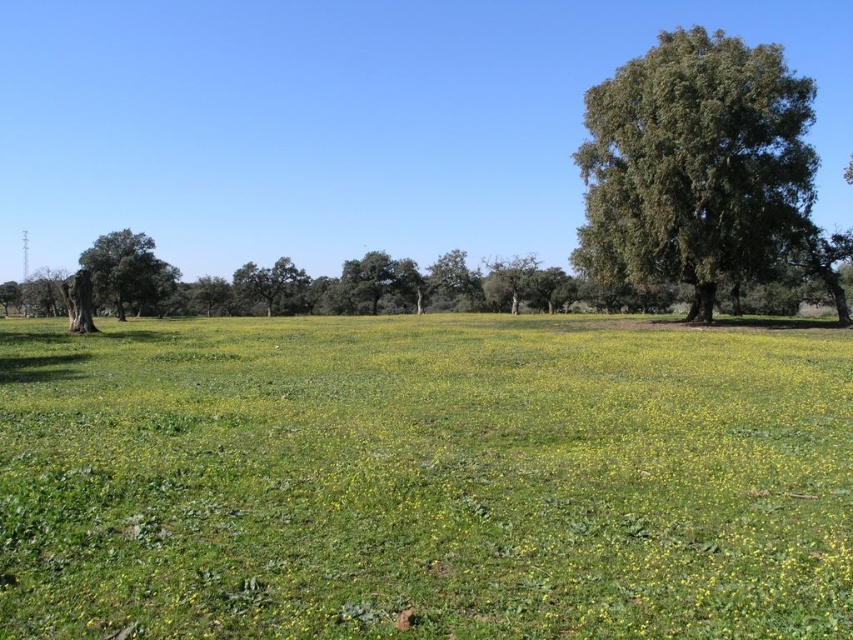
You are standing at the center of the field and want to walk towards the smooth green tree at left. Which direction should you face to head directly towards it?

You should face towards the left direction to head directly towards the smooth green tree at left since it is located at point (126, 272) which is to the left of the center point.

You are standing at the point labeled point (695,164) in the image. What object is located exactly at this point?

The point (695,164) is exactly where the green leafy tree at right is located.